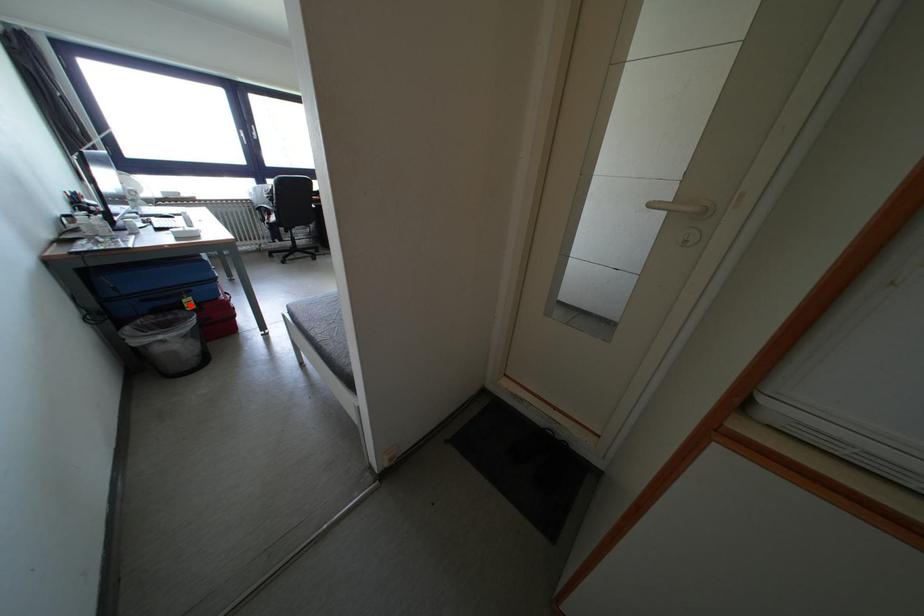
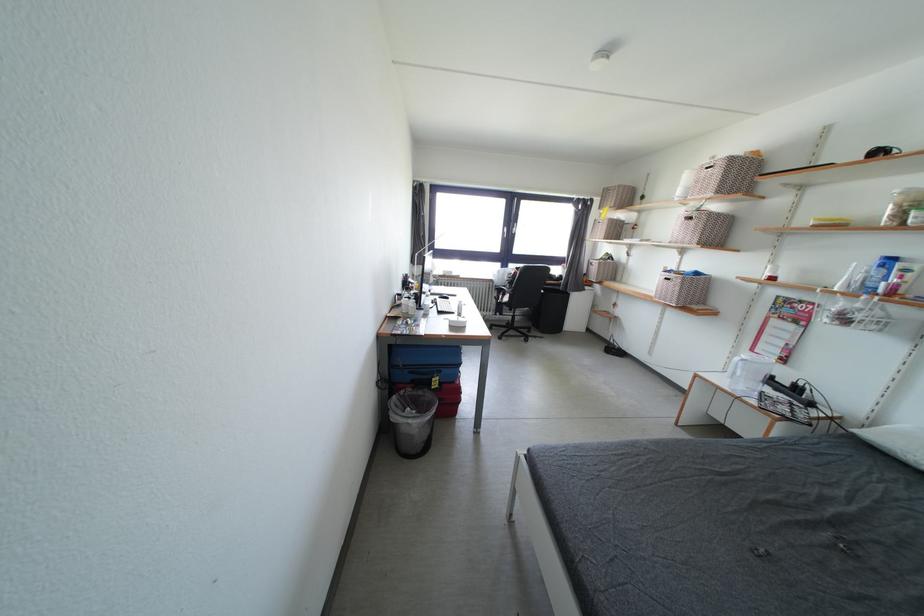
Question: I am providing you with two images of the same scene from different viewpoints. A red point is marked on the first image. Is the red point's position out of view in image 2?

Choices:
 (A) Yes
 (B) No

Answer: (B)